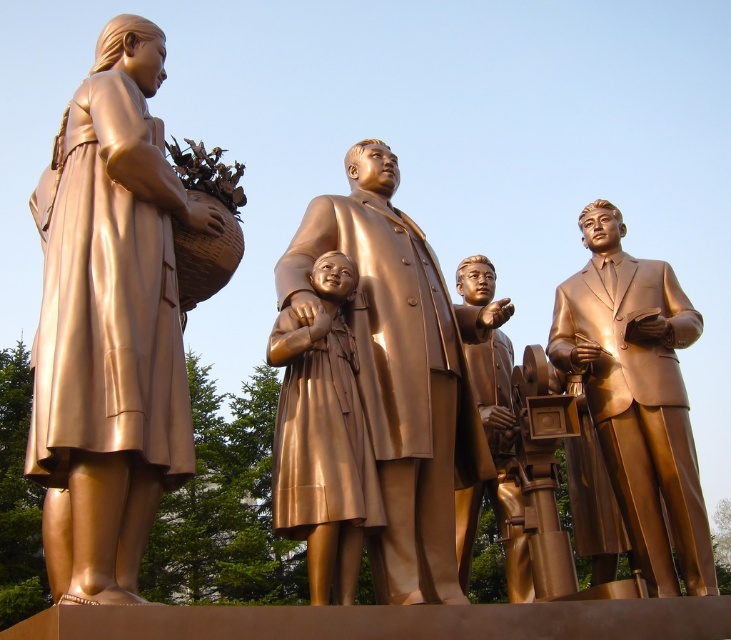
Looking at this image, you are an art curator planning to move the bronze statue of child at center to the right side of the bronze statue at center. Is this possible without overlapping them?

The bronze statue at center is positioned over bronze statue of child at center, so moving the bronze statue of child at center to the right side of the bronze statue at center would require adjusting their positions to avoid overlap.

You are a tour guide explaining the layout of the statues to visitors. You want to mention the distance between the bronze statue at center and the bronze statue of child at center. What do you say?

The bronze statue at center and the bronze statue of child at center are 3.50 meters apart.